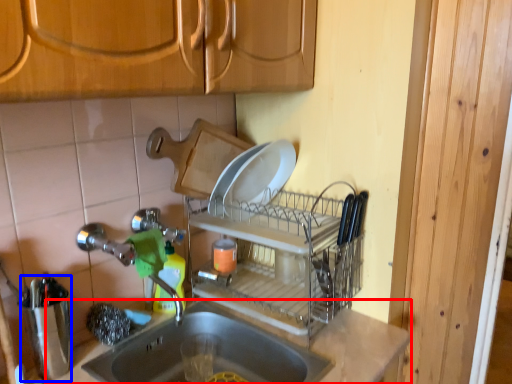
Question: Which point is closer to the camera, countertop (highlighted by a red box) or appliance (highlighted by a blue box)?

Choices:
 (A) countertop
 (B) appliance

Answer: (A)